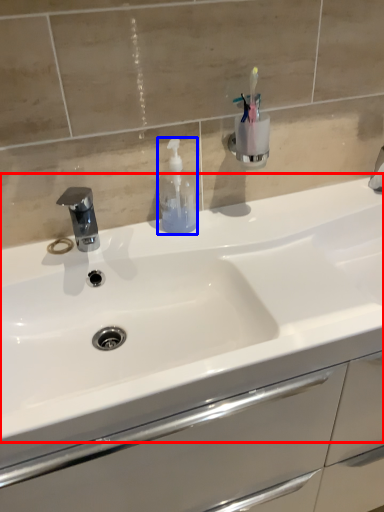
Question: Which point is further to the camera, sink (highlighted by a red box) or soap dispenser (highlighted by a blue box)?

Choices:
 (A) sink
 (B) soap dispenser

Answer: (B)